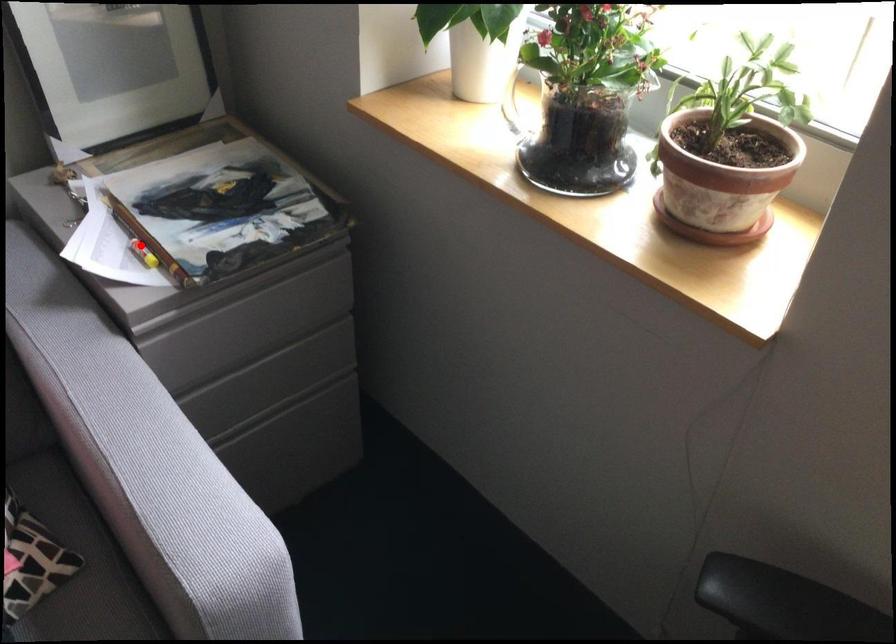
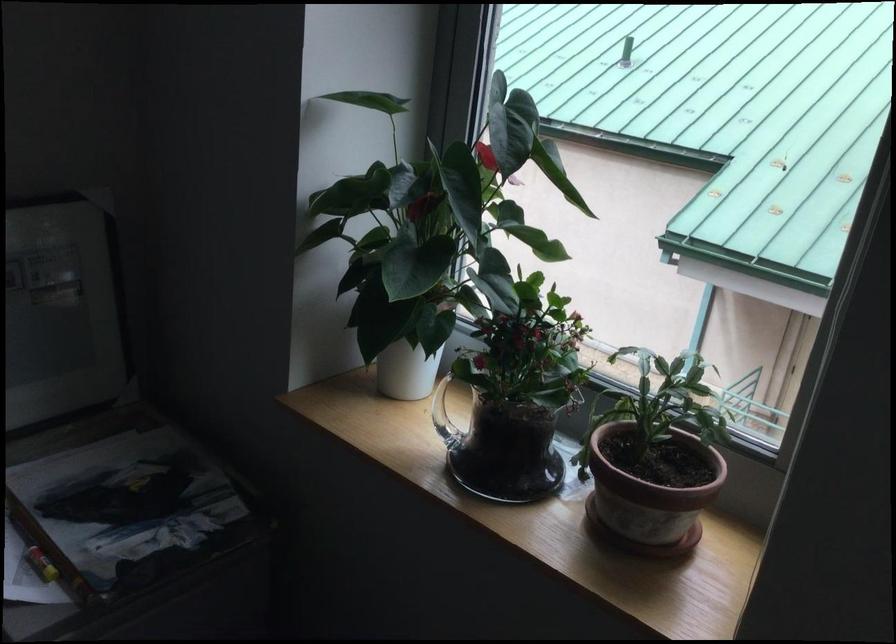
In the second image, find the point that corresponds to the highlighted location in the first image.

(40, 564)